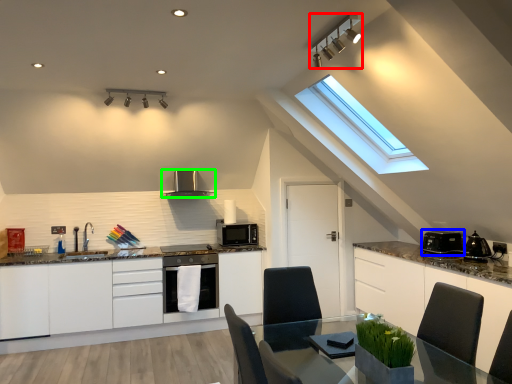
Question: Which is farther away from light fixture (highlighted by a red box)? appliance (highlighted by a blue box) or kitchen appliance (highlighted by a green box)?

Choices:
 (A) appliance
 (B) kitchen appliance

Answer: (B)